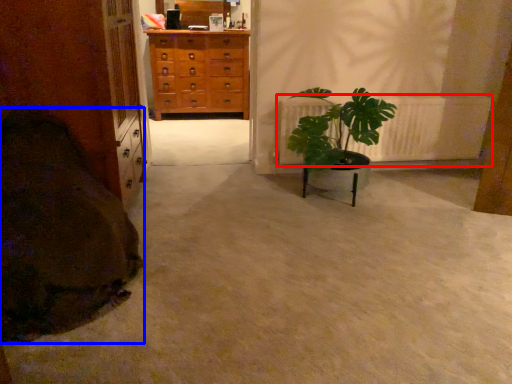
Question: Among these objects, which one is farthest to the camera, radiator (highlighted by a red box) or blanket (highlighted by a blue box)?

Choices:
 (A) radiator
 (B) blanket

Answer: (A)